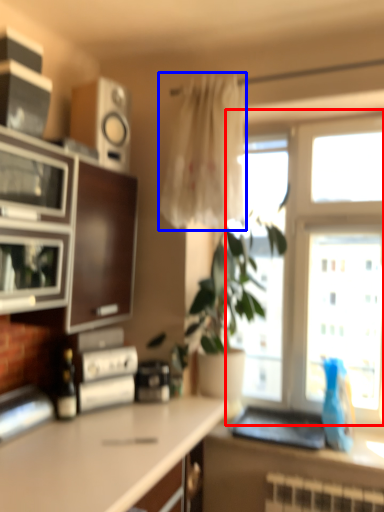
Question: Which object is further to the camera taking this photo, window (highlighted by a red box) or curtain (highlighted by a blue box)?

Choices:
 (A) window
 (B) curtain

Answer: (A)